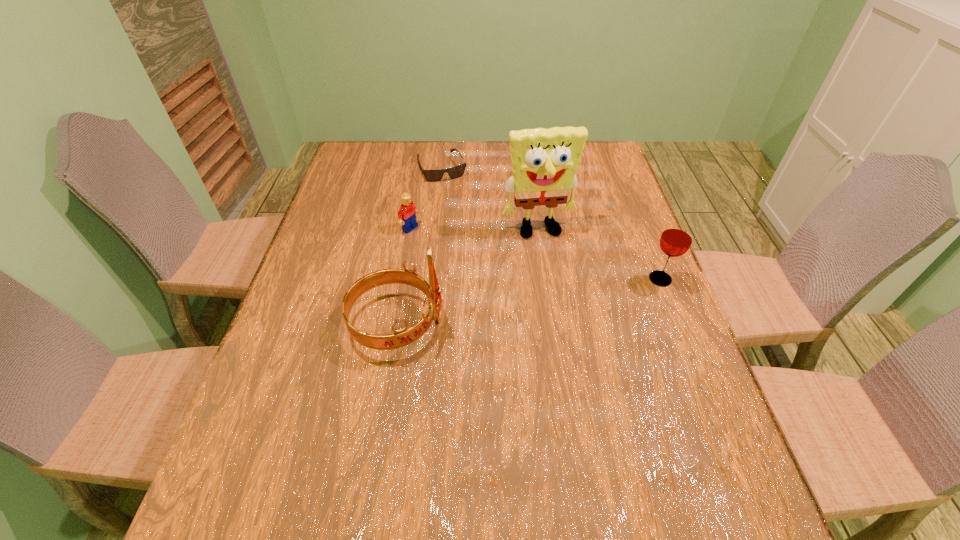
This screenshot has width=960, height=540. In order to click on unoccupied position between the shortest object and the tallest object in this screenshot , I will do `click(491, 199)`.

The width and height of the screenshot is (960, 540). I want to click on free spot between the tallest object and the rightmost object, so click(599, 255).

This screenshot has width=960, height=540. Identify the location of vacant area that lies between the third shortest object and the tallest object. (599, 255).

The height and width of the screenshot is (540, 960). I want to click on vacant area that lies between the tallest object and the shortest object, so click(491, 199).

At what (x,y) coordinates should I click in order to perform the action: click on object that ranks as the third closest to the shortest object. Please return your answer as a coordinate pair (x, y). Looking at the image, I should click on (402, 337).

Point out which object is positioned as the second nearest to the tiara. Please provide its 2D coordinates. Your answer should be formatted as a tuple, i.e. [(x, y)], where the tuple contains the x and y coordinates of a point satisfying the conditions above.

[(544, 161)]

Find the location of a particular element. vacant region that satisfies the following two spatial constraints: 1. on the front side of the fourth tallest object; 2. on the front-facing side of the nearest object is located at coordinates (394, 323).